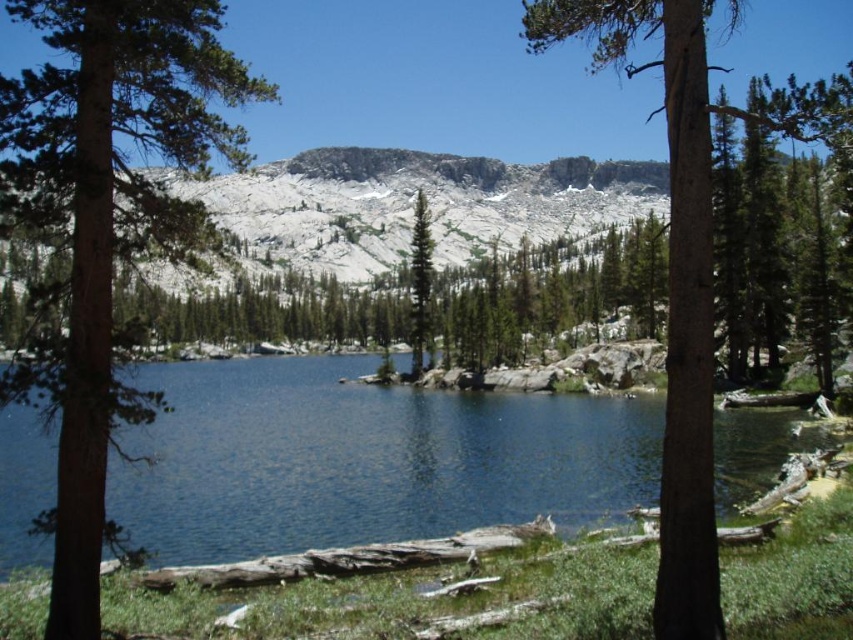
You are standing on the rocky shoreline of the lake and want to take a photo of both the deep blue water at center and the green matte tree at left. Which object should you focus on first if you want to capture both in the same frame without moving your camera?

The deep blue water at center has a lesser height compared to the green matte tree at left, so you should focus on the green matte tree at left first to ensure both are in focus since it is taller and closer to the background.

You are standing at the edge of the lake and notice two trees in the scene. Which tree is positioned to the left of the other? The options are the green matte tree at left and the brown rough bark tree at center.

The green matte tree at left is positioned to the left of the brown rough bark tree at center.

You are standing at the center of the image. Which direction should you walk to reach the green matte tree at left?

You should walk to the left to reach the green matte tree at left since it is located at point (x=107, y=220), which is to the left of the center.